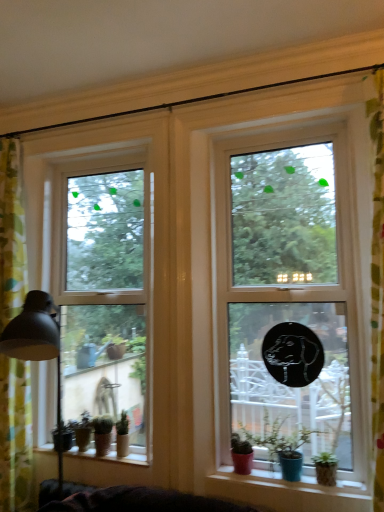
Identify the location of clear glass window at left, which is the first window in back-to-front order. The image size is (384, 512). (109, 288).

Locate an element on the screen. The image size is (384, 512). matte black lampshade at left is located at coordinates (37, 343).

In order to face green matte houseplant at lower left, the 3th houseplant positioned from the right, should I rotate leftwards or rightwards?

It's best to rotate left around 11.904 degrees.

Describe the element at coordinates (287, 490) in the screenshot. I see `matte ceramic pots at lower center, arranged as the 2th window sill when viewed from the back` at that location.

At what (x,y) coordinates should I click in order to perform the action: click on green matte plant pot at lower left, acting as the first houseplant starting from the back. Please return your answer as a coordinate pair (x, y). The image size is (384, 512). Looking at the image, I should click on (82, 430).

Starting from the matte ceramic pots at lower center, marked as the second window sill in a left-to-right arrangement, which houseplant is the 1st one behind? Please provide its 2D coordinates.

[(280, 444)]

Is matte ceramic pots at lower center, marked as the second window sill in a left-to-right arrangement, facing away from matte pink pot at lower center, which ranks as the 4th houseplant in left-to-right order?

Correct, matte ceramic pots at lower center, marked as the second window sill in a left-to-right arrangement, is looking away from matte pink pot at lower center, which ranks as the 4th houseplant in left-to-right order.

Is point (267, 476) less distant than point (273, 426)?

Yes, it is.

Is matte ceramic pots at lower center, the first window sill from the front, next to matte pink pot at lower center, the 4th houseplant in the back-to-front sequence?

There is a gap between matte ceramic pots at lower center, the first window sill from the front, and matte pink pot at lower center, the 4th houseplant in the back-to-front sequence.

Is matte pink pot at lower center, the 4th houseplant in the back-to-front sequence, located outside green matte houseplant at lower left, the 3th houseplant positioned from the right?

Yes, matte pink pot at lower center, the 4th houseplant in the back-to-front sequence, is located beyond the bounds of green matte houseplant at lower left, the 3th houseplant positioned from the right.

Is matte pink pot at lower center, the 4th houseplant in the back-to-front sequence, at the left side of green matte houseplant at lower left, acting as the 2th houseplant starting from the left?

No, matte pink pot at lower center, the 4th houseplant in the back-to-front sequence, is not to the left of green matte houseplant at lower left, acting as the 2th houseplant starting from the left.

Between point (272, 468) and point (100, 419), which one is positioned behind?

The point (100, 419) is more distant.

Can you confirm if matte pink pot at lower center, the first houseplant positioned from the front, is taller than green matte houseplant at lower left, acting as the 2th houseplant starting from the left?

Yes, matte pink pot at lower center, the first houseplant positioned from the front, is taller than green matte houseplant at lower left, acting as the 2th houseplant starting from the left.

Does green floral fabric curtain at left have a greater height compared to clear glass window at left, which is the 2th window in front-to-back order?

Indeed, green floral fabric curtain at left has a greater height compared to clear glass window at left, which is the 2th window in front-to-back order.

Is green floral fabric curtain at left inside or outside of clear glass window at left, which is the 2th window in front-to-back order?

green floral fabric curtain at left lies outside clear glass window at left, which is the 2th window in front-to-back order.

From a real-world perspective, relative to clear glass window at left, which ranks as the second window in right-to-left order, is green floral fabric curtain at left vertically above or below?

In terms of real-world spatial position, green floral fabric curtain at left is below clear glass window at left, which ranks as the second window in right-to-left order.

From the image's perspective, which is below, green matte houseplant at lower left, acting as the third houseplant starting from the back, or green matte plant pot at lower left, which is the fourth houseplant in right-to-left order?

green matte plant pot at lower left, which is the fourth houseplant in right-to-left order, from the image's perspective.

Between point (118, 448) and point (89, 418), which one is positioned in front?

The point (118, 448) is closer.

Is green matte houseplant at lower left, the 2th houseplant positioned from the front, far from green matte plant pot at lower left, which is counted as the first houseplant, starting from the left?

No, there isn't a large distance between green matte houseplant at lower left, the 2th houseplant positioned from the front, and green matte plant pot at lower left, which is counted as the first houseplant, starting from the left.

Looking at this image, would you say green matte houseplant at lower left, acting as the third houseplant starting from the back, contains green matte plant pot at lower left, which is counted as the first houseplant, starting from the left?

Actually, green matte plant pot at lower left, which is counted as the first houseplant, starting from the left, is outside green matte houseplant at lower left, acting as the third houseplant starting from the back.

Who is bigger, green matte houseplant at lower left, acting as the 2th houseplant starting from the left, or green matte houseplant at lower left, the second houseplant when ordered from right to left?

With larger size is green matte houseplant at lower left, acting as the 2th houseplant starting from the left.

What's the angular difference between green matte houseplant at lower left, the 3th houseplant positioned from the right, and green matte houseplant at lower left, acting as the third houseplant starting from the back,'s facing directions?

2.7 degrees.

From the image's perspective, who appears lower, green matte houseplant at lower left, acting as the 2th houseplant starting from the left, or green matte houseplant at lower left, the second houseplant when ordered from right to left?

green matte houseplant at lower left, acting as the 2th houseplant starting from the left, is shown below in the image.

Is green matte houseplant at lower left, the 3th houseplant from the front, facing towards green matte houseplant at lower left, which ranks as the third houseplant in left-to-right order?

No, green matte houseplant at lower left, the 3th houseplant from the front, is not oriented towards green matte houseplant at lower left, which ranks as the third houseplant in left-to-right order.

How many degrees apart are the facing directions of smooth wooden window sill at lower left, arranged as the 2th window sill when viewed from the right, and matte pink pot at lower center, which ranks as the 4th houseplant in left-to-right order?

The angle between the facing direction of smooth wooden window sill at lower left, arranged as the 2th window sill when viewed from the right, and the facing direction of matte pink pot at lower center, which ranks as the 4th houseplant in left-to-right order, is 0.972 degrees.

From the image's perspective, which one is positioned higher, smooth wooden window sill at lower left, arranged as the 2th window sill when viewed from the right, or matte pink pot at lower center, the 4th houseplant in the back-to-front sequence?

matte pink pot at lower center, the 4th houseplant in the back-to-front sequence, appears higher in the image.

Based on the photo, from a real-world perspective, which object stands above the other?

matte pink pot at lower center, the 4th houseplant in the back-to-front sequence, is physically above.

Is matte pink pot at lower center, the first houseplant positioned from the front, completely or partially outside of smooth wooden window sill at lower left, placed as the 2th window sill when sorted from front to back?

Yes.

Based on the photo, from a real-world perspective, who is located higher, matte pink pot at lower center, which ranks as the 4th houseplant in left-to-right order, or smooth wooden window sill at lower left, placed as the 2th window sill when sorted from front to back?

From a 3D spatial view, matte pink pot at lower center, which ranks as the 4th houseplant in left-to-right order, is above.

Considering the relative positions of matte pink pot at lower center, which ranks as the 4th houseplant in left-to-right order, and smooth wooden window sill at lower left, placed as the 2th window sill when sorted from front to back, in the image provided, is matte pink pot at lower center, which ranks as the 4th houseplant in left-to-right order, to the right of smooth wooden window sill at lower left, placed as the 2th window sill when sorted from front to back, from the viewer's perspective?

Yes.

Where is `the 4th houseplant above the matte ceramic pots at lower center, the 1th window sill in the right-to-left sequence (from a real-world perspective)`? The image size is (384, 512). the 4th houseplant above the matte ceramic pots at lower center, the 1th window sill in the right-to-left sequence (from a real-world perspective) is located at coordinates (280, 444).

From a real-world perspective, count 3rd houseplants downward from the matte pink pot at lower center, which is the 1th houseplant from right to left, and point to it. Please provide its 2D coordinates.

[(102, 434)]

Which object lies further to the anchor point transparent glass window at center, positioned as the 1th window in right-to-left order, green matte plant pot at lower left, acting as the first houseplant starting from the back, or matte black lampshade at left?

→ green matte plant pot at lower left, acting as the first houseplant starting from the back, is positioned further to the anchor transparent glass window at center, positioned as the 1th window in right-to-left order.

Based on their spatial positions, is matte ceramic pots at lower center, the 1th window sill in the right-to-left sequence, or green matte plant pot at lower left, which is counted as the first houseplant, starting from the left, further from green floral fabric curtain at left?

matte ceramic pots at lower center, the 1th window sill in the right-to-left sequence, lies further to green floral fabric curtain at left than the other object.

When comparing their distances from green matte plant pot at lower left, the fourth houseplant positioned from the front, does transparent glass window at center, which ranks as the 2th window in left-to-right order, or smooth wooden window sill at lower left, the first window sill positioned from the left, seem closer?

smooth wooden window sill at lower left, the first window sill positioned from the left, lies closer to green matte plant pot at lower left, the fourth houseplant positioned from the front, than the other object.

From the image, which object appears to be farther from matte pink pot at lower center, which is the 1th houseplant from right to left, green matte houseplant at lower left, the second houseplant when ordered from right to left, or matte black lampshade at left?

matte black lampshade at left is further to matte pink pot at lower center, which is the 1th houseplant from right to left.

When comparing their distances from clear glass window at left, which is the 2th window in front-to-back order, does green matte houseplant at lower left, the second houseplant when ordered from right to left, or green floral fabric curtain at left seem closer?

Among the two, green floral fabric curtain at left is located nearer to clear glass window at left, which is the 2th window in front-to-back order.

Which object lies further to the anchor point green matte plant pot at lower left, acting as the first houseplant starting from the back, smooth wooden window sill at lower left, the first window sill positioned from the left, or matte black lampshade at left?

matte black lampshade at left is positioned further to the anchor green matte plant pot at lower left, acting as the first houseplant starting from the back.

Estimate the real-world distances between objects in this image. Which object is further from transparent glass window at center, positioned as the 1th window in right-to-left order, green floral fabric curtain at left or green matte houseplant at lower left, the 2th houseplant when ordered from back to front?

green floral fabric curtain at left.

Which object lies further to the anchor point green floral fabric curtain at left, green matte houseplant at lower left, the 2th houseplant positioned from the front, or matte pink pot at lower center, which ranks as the 4th houseplant in left-to-right order?

Based on the image, matte pink pot at lower center, which ranks as the 4th houseplant in left-to-right order, appears to be further to green floral fabric curtain at left.

The image size is (384, 512). In order to click on window sill situated between green floral fabric curtain at left and transparent glass window at center, the 2th window viewed from the back, from left to right in this screenshot , I will do `click(128, 455)`.

Where is `table lamp that lies between green floral fabric curtain at left and smooth wooden window sill at lower left, placed as the 2th window sill when sorted from front to back, from top to bottom`? table lamp that lies between green floral fabric curtain at left and smooth wooden window sill at lower left, placed as the 2th window sill when sorted from front to back, from top to bottom is located at coordinates (37, 343).

Where is `table lamp located between green floral fabric curtain at left and matte pink pot at lower center, which is the 1th houseplant from right to left, in the left-right direction`? table lamp located between green floral fabric curtain at left and matte pink pot at lower center, which is the 1th houseplant from right to left, in the left-right direction is located at coordinates (37, 343).

The image size is (384, 512). In order to click on window sill situated between green floral fabric curtain at left and matte pink pot at lower center, which is the 1th houseplant from right to left, from left to right in this screenshot , I will do `click(128, 455)`.